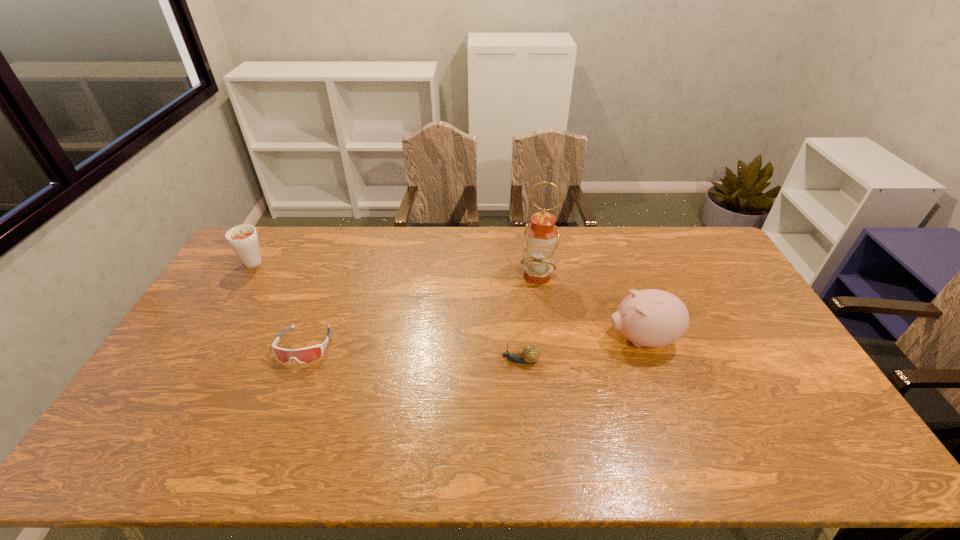
Where is `oil lamp`? oil lamp is located at coordinates (541, 237).

Locate an element on the screen. This screenshot has width=960, height=540. the leftmost object is located at coordinates (243, 239).

Find the location of a particular element. This screenshot has width=960, height=540. the rightmost object is located at coordinates (652, 318).

At what (x,y) coordinates should I click in order to perform the action: click on goggles. Please return your answer as a coordinate pair (x, y). Looking at the image, I should click on point(303,355).

The height and width of the screenshot is (540, 960). Find the location of `escargot`. escargot is located at coordinates (529, 354).

Locate an element on the screen. The height and width of the screenshot is (540, 960). free spot located 0.390m on the front of the tallest object is located at coordinates (553, 383).

Where is `vacant space located 0.200m on the drink side of the leftmost object`? This screenshot has height=540, width=960. vacant space located 0.200m on the drink side of the leftmost object is located at coordinates (219, 320).

I want to click on vacant space located at the snout of the rightmost object, so click(560, 339).

This screenshot has height=540, width=960. Find the location of `vacant region located at the snout of the rightmost object`. vacant region located at the snout of the rightmost object is located at coordinates (480, 339).

You are a GUI agent. You are given a task and a screenshot of the screen. Output one action in this format:
    pyautogui.click(x=<x>, y=<y>)
    Task: Click on the vacant area located 0.210m at the snout of the rightmost object
    The width and height of the screenshot is (960, 540).
    Given the screenshot: What is the action you would take?
    pyautogui.click(x=536, y=339)